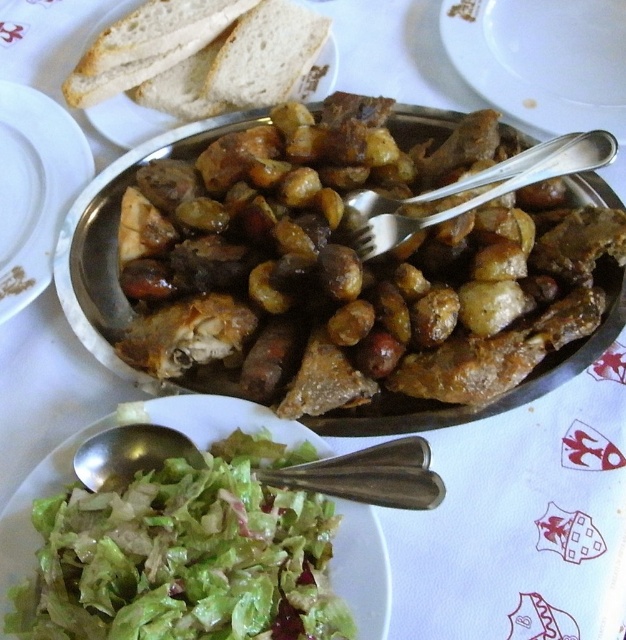
Question: Which point is farther from the camera taking this photo?

Choices:
 (A) (423, 449)
 (B) (93, 52)
 (C) (582, 68)

Answer: (C)

Question: Does green leafy salad at lower left appear over silvermetallicspoon at lower left?

Choices:
 (A) no
 (B) yes

Answer: (A)

Question: Among these objects, which one is farthest from the camera?

Choices:
 (A) brown matte platter at center
 (B) green leafy salad at lower left
 (C) white soft bread at upper left
 (D) satin silver fork at upper center

Answer: (C)

Question: Which point is farther to the camera?

Choices:
 (A) white glossy plate at upper center
 (B) green leafy salad at lower left
 (C) satin silver fork at upper center
 (D) brown matte platter at center

Answer: (A)

Question: Can you confirm if green leafy salad at lower left is positioned above white soft bread at upper left?

Choices:
 (A) no
 (B) yes

Answer: (A)

Question: Can you confirm if green leafy salad at lower left is positioned below satin silver fork at upper center?

Choices:
 (A) yes
 (B) no

Answer: (A)